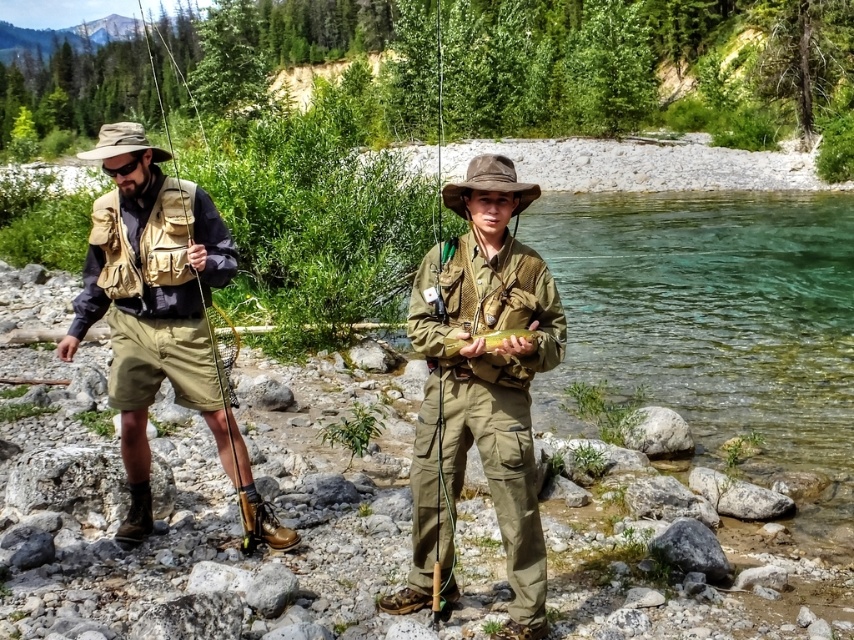
You are an outdoor photographer trying to capture a closeup of the fishing gear while ensuring both the matte khaki shorts at left and the matte brown fishing pole at left are visible in the frame. Which object should you zoom in on to ensure both are in the shot without cropping either?

You should zoom in on the matte khaki shorts at left because it occupies less space than the matte brown fishing pole at left, allowing both to fit within the frame without cropping.

You are a photographer positioned at the center of the scene. You want to take a photo that includes both the matte brown fishing pole at left and the small fish held by the person on the right. Based on their positions, will the fishing pole be to the left or right of the fish in the photo?

The matte brown fishing pole at left is located at point 0.130 on the x and y axis, so it will be to the left of the fish in the photo.

You are a photographer trying to capture the person in the khaki shorts at left without the fishing pole blocking the view. Can you position yourself so that the matte khaki shorts at left is visible without the matte brown fishing pole at left obstructing it?

The matte khaki shorts at left is in front of the matte brown fishing pole at left, so positioning yourself behind the shorts would allow you to see the shorts without the fishing pole blocking the view.